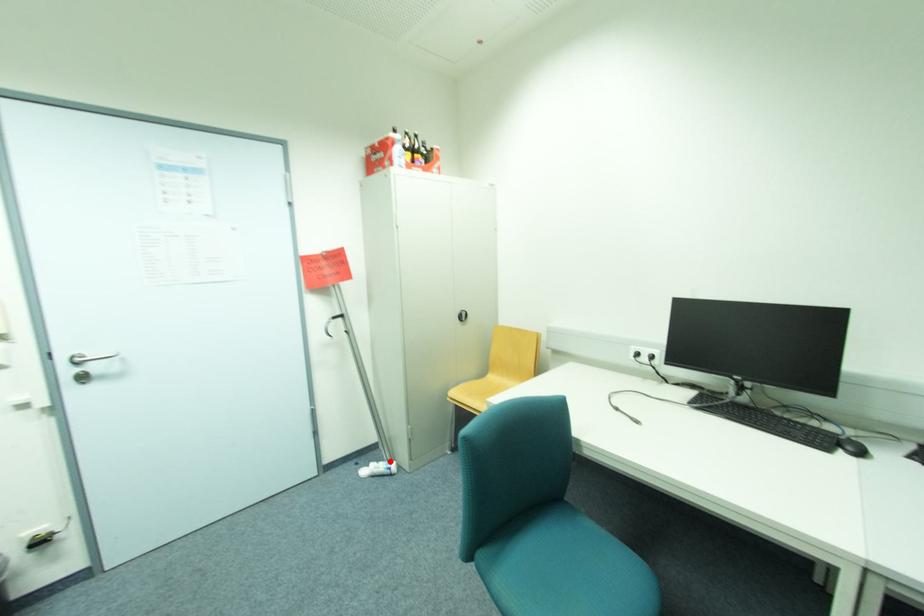
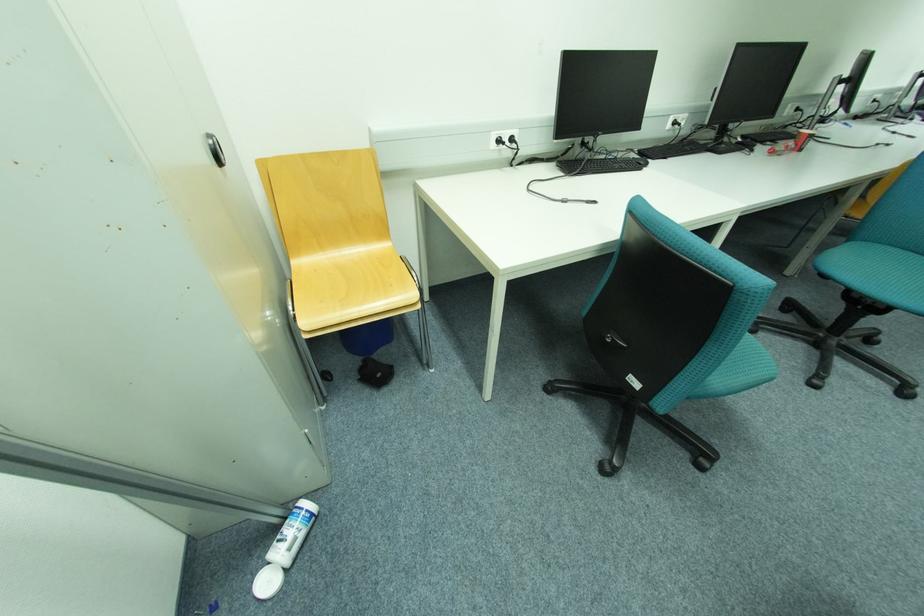
Question: I am providing you with two images of the same scene from different viewpoints. Given a red point in image1, look at the same physical point in image2. Is it:

Choices:
 (A) Closer to the viewpoint
 (B) Farther from the viewpoint

Answer: (A)